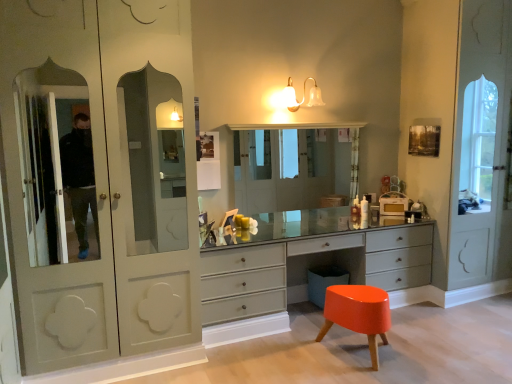
This screenshot has width=512, height=384. In order to click on blank space situated above clear glass medicine cabinet at center (from a real-world perspective) in this screenshot , I will do `click(297, 125)`.